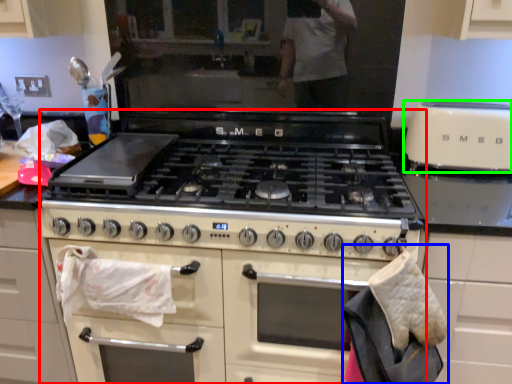
Question: Based on their relative distances, which object is farther from appliance (highlighted by a red box)? Choose from material (highlighted by a blue box) and kitchen appliance (highlighted by a green box).

Choices:
 (A) material
 (B) kitchen appliance

Answer: (B)